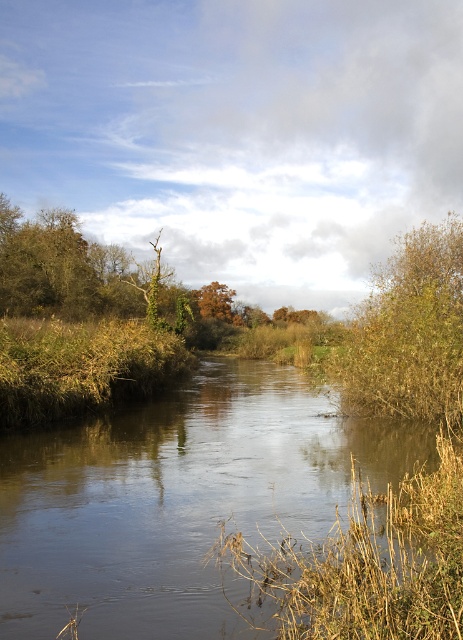
Does smooth brown water at center lie in front of brown textured bush at right?

Yes.

Does point (160, 506) come farther from viewer compared to point (427, 253)?

No, (160, 506) is in front of (427, 253).

Is point (317, 458) closer to camera compared to point (398, 310)?

That is True.

Where is `smooth brown water at center`? smooth brown water at center is located at coordinates (181, 500).

Between smooth brown water at center and orange matte tree at center, which one appears on the right side from the viewer's perspective?

Positioned to the right is smooth brown water at center.

Between point (114, 438) and point (205, 291), which one is positioned behind?

The point (205, 291) is behind.

The image size is (463, 640). In order to click on smooth brown water at center in this screenshot , I will do `click(181, 500)`.

Who is taller, brown textured bush at right or orange matte tree at center?

With more height is brown textured bush at right.

Is brown textured bush at right positioned behind orange matte tree at center?

That is False.

Identify the location of brown textured bush at right. This screenshot has height=640, width=463. (407, 332).